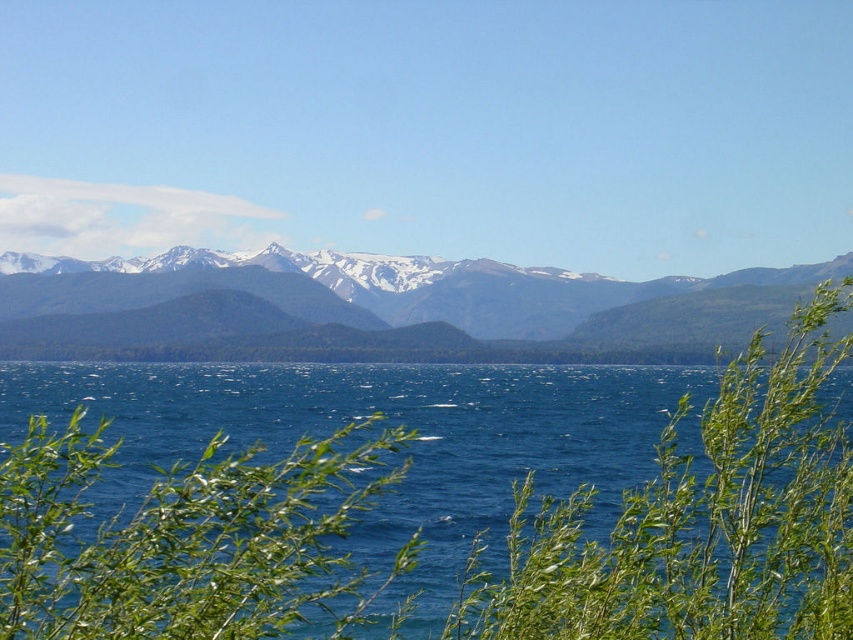
You are standing at the edge of the lake and see the smokey gray mountains at center and the green leafy plant at lower center. Which object is closer to you?

The green leafy plant at lower center is closer to you because it is positioned behind the smokey gray mountains at center, meaning the mountains are in front of it.

You are standing at the edge of the lake and want to walk to the mountains. The path goes straight through the green leafy plant at center and the smokey gray mountains at center. If your walking speed is 5 km per hour, how long would it take you to reach the mountains?

The distance between the green leafy plant at center and the smokey gray mountains at center is 288.02 meters. Converting meters to kilometers, it becomes 0.288 kilometers. Dividing this by your walking speed of 5 km per hour gives 0.0576 hours. Multiplying by 60 minutes per hour, the total time required is approximately 3.46 minutes. Therefore, it would take roughly 3.5 minutes to reach the mountains.